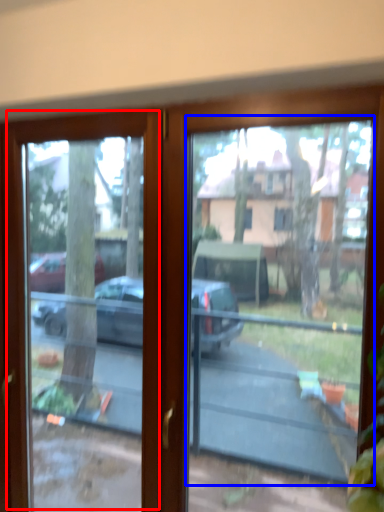
Question: Among these objects, which one is farthest to the camera, screen door (highlighted by a red box) or bay window (highlighted by a blue box)?

Choices:
 (A) screen door
 (B) bay window

Answer: (A)